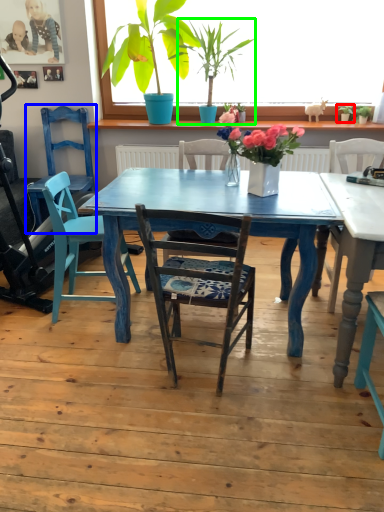
Question: Estimate the real-world distances between objects in this image. Which object is farther from houseplant (highlighted by a red box), armchair (highlighted by a blue box) or houseplant (highlighted by a green box)?

Choices:
 (A) armchair
 (B) houseplant

Answer: (A)